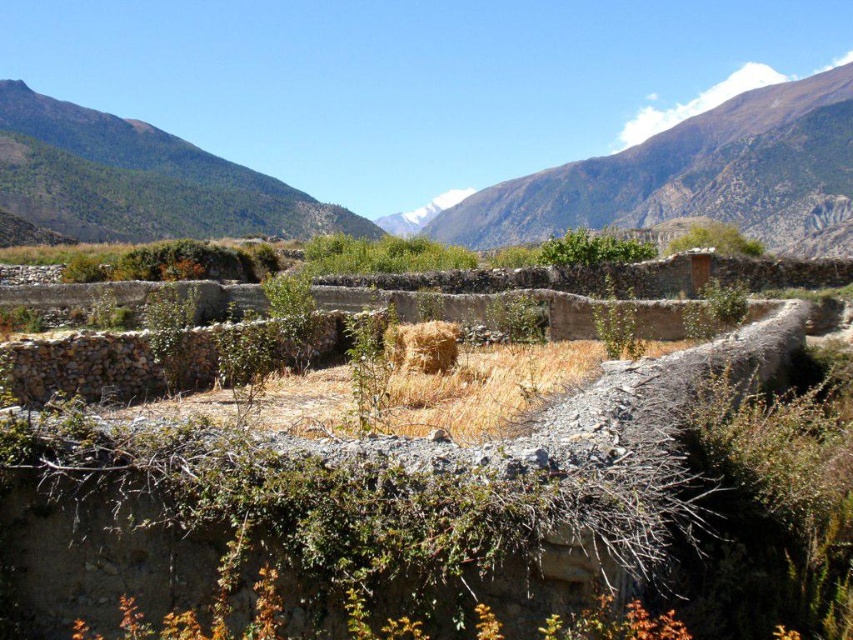
You are a hiker planning to take a photo of both the snowy rocky mountain at upper right and the green textured mountain at left. Which mountain should you stand closer to in order to capture both in a single frame?

You should stand closer to the green textured mountain at left because the snowy rocky mountain at upper right is larger in size, so being nearer to the smaller one will help include both mountains within the camera frame.

You are a hiker standing at the yellow straw bale at center in a mountainous area. You want to take a photo of the green textured mountain at left. Which direction should you face to capture the mountain in your view?

The green textured mountain at left is above the yellow straw bale at center, so you should look upwards to capture the mountain in your view.

In the scene shown: You are a hiker who wants to take a photo of the yellow straw bale at center without the snowy rocky mountain at upper right blocking the view. Is there a way to adjust your position to achieve this?

The snowy rocky mountain at upper right is positioned over the yellow straw bale at center, so moving to a lower or side position might allow you to capture the yellow straw bale at center without the mountain blocking the view.